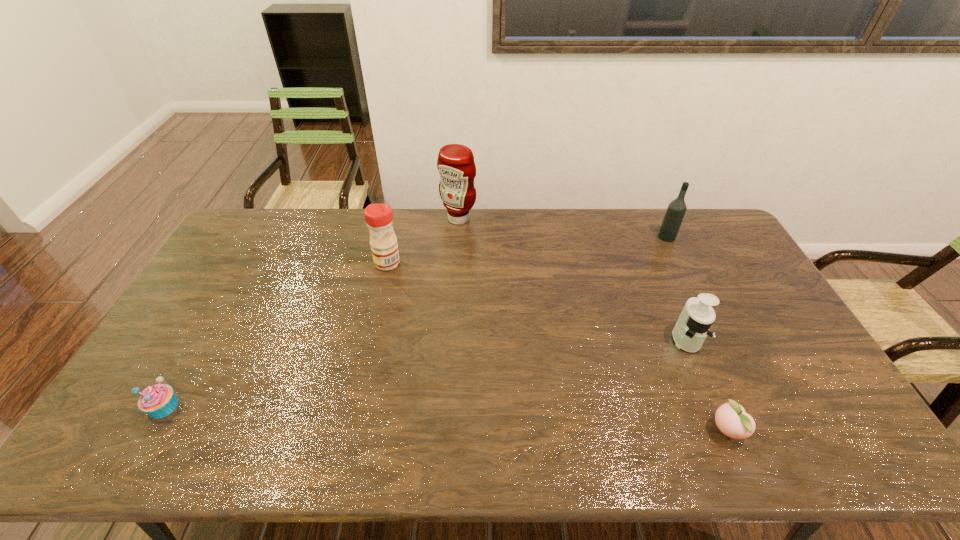
I want to click on the right condiment, so click(455, 164).

Locate an element on the screen. The height and width of the screenshot is (540, 960). the tallest object is located at coordinates (455, 164).

The width and height of the screenshot is (960, 540). I want to click on the left condiment, so click(378, 217).

This screenshot has width=960, height=540. I want to click on the shorter condiment, so click(x=378, y=217).

This screenshot has height=540, width=960. I want to click on the fifth nearest object, so click(676, 210).

I want to click on the rightmost object, so click(676, 210).

In order to click on the third shortest object in this screenshot , I will do `click(697, 316)`.

Identify the location of juicer. (697, 316).

Image resolution: width=960 pixels, height=540 pixels. In order to click on peach in this screenshot , I will do coord(731,419).

Find the location of `muffin`. muffin is located at coordinates (158, 401).